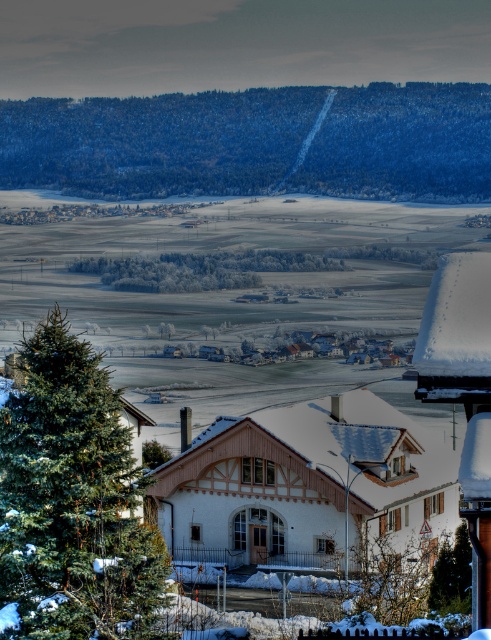
Does green textured hillside at upper center appear over white wooden house at center?

Correct, green textured hillside at upper center is located above white wooden house at center.

Who is positioned more to the left, green textured hillside at upper center or white wooden house at center?

Positioned to the left is green textured hillside at upper center.

What are the coordinates of `green textured hillside at upper center` in the screenshot? It's located at (256, 141).